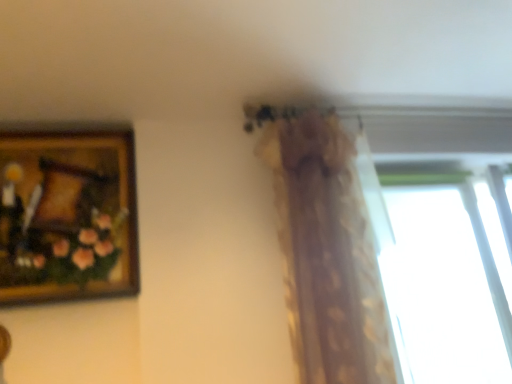
Question: Does transparent glass window at upper right have a smaller size compared to translucent floral-patterned curtain at upper center?

Choices:
 (A) yes
 (B) no

Answer: (A)

Question: Is transparent glass window at upper right turned away from translucent floral-patterned curtain at upper center?

Choices:
 (A) no
 (B) yes

Answer: (A)

Question: From a real-world perspective, is transparent glass window at upper right located higher than translucent floral-patterned curtain at upper center?

Choices:
 (A) no
 (B) yes

Answer: (A)

Question: Is translucent floral-patterned curtain at upper center completely or partially inside transparent glass window at upper right?

Choices:
 (A) no
 (B) yes

Answer: (A)

Question: Is transparent glass window at upper right thinner than translucent floral-patterned curtain at upper center?

Choices:
 (A) yes
 (B) no

Answer: (A)

Question: Does point (326, 162) appear closer or farther from the camera than point (404, 294)?

Choices:
 (A) farther
 (B) closer

Answer: (B)

Question: Choose the correct answer: Is translucent floral-patterned curtain at upper center inside transparent glass window at upper right or outside it?

Choices:
 (A) inside
 (B) outside

Answer: (B)

Question: Considering the relative positions of translucent floral-patterned curtain at upper center and transparent glass window at upper right in the image provided, is translucent floral-patterned curtain at upper center to the left or to the right of transparent glass window at upper right?

Choices:
 (A) left
 (B) right

Answer: (A)

Question: Considering the positions of translucent floral-patterned curtain at upper center and transparent glass window at upper right in the image, is translucent floral-patterned curtain at upper center taller or shorter than transparent glass window at upper right?

Choices:
 (A) short
 (B) tall

Answer: (B)

Question: From their relative heights in the image, would you say translucent floral-patterned curtain at upper center is taller or shorter than wooden framed painting at upper left?

Choices:
 (A) short
 (B) tall

Answer: (B)

Question: Looking at their shapes, would you say translucent floral-patterned curtain at upper center is wider or thinner than wooden framed painting at upper left?

Choices:
 (A) thin
 (B) wide

Answer: (B)

Question: Is point (391, 357) closer or farther from the camera than point (11, 281)?

Choices:
 (A) closer
 (B) farther

Answer: (B)

Question: From the image's perspective, is translucent floral-patterned curtain at upper center above or below wooden framed painting at upper left?

Choices:
 (A) above
 (B) below

Answer: (B)

Question: Does point (369, 173) appear closer or farther from the camera than point (292, 274)?

Choices:
 (A) farther
 (B) closer

Answer: (A)

Question: From a real-world perspective, relative to translucent floral-patterned curtain at upper center, is transparent glass window at upper right vertically above or below?

Choices:
 (A) above
 (B) below

Answer: (B)